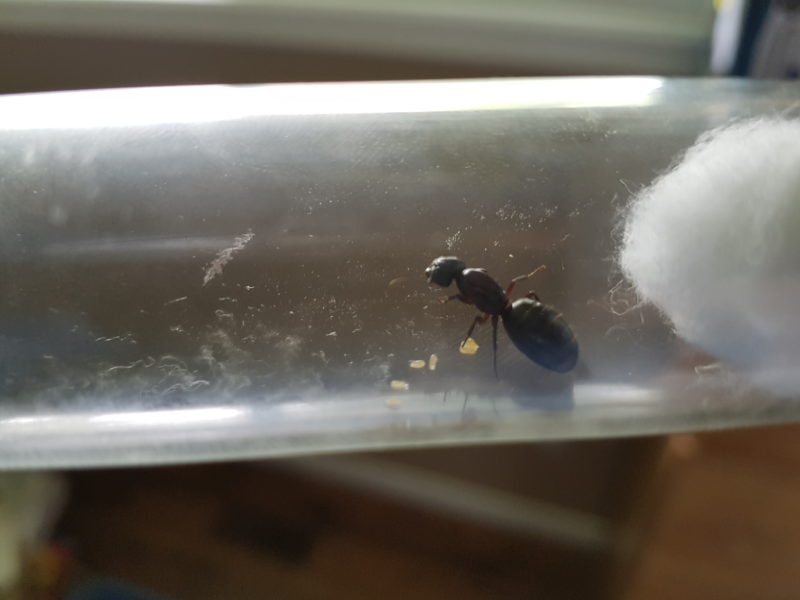
In order to click on vent in this screenshot , I will do `click(286, 545)`.